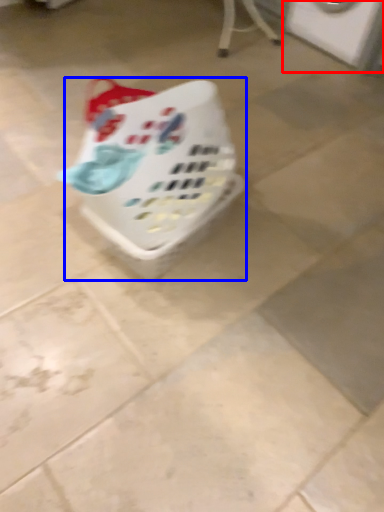
Question: Which point is closer to the camera, washing machine (highlighted by a red box) or basket (highlighted by a blue box)?

Choices:
 (A) washing machine
 (B) basket

Answer: (B)